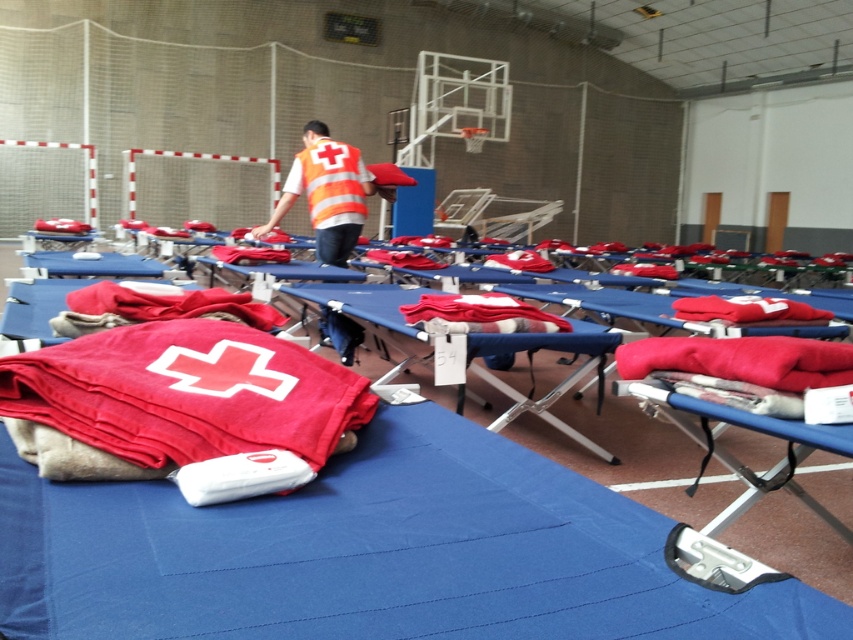
Can you confirm if orange reflective safety vest at center is wider than red cotton cloth at center?

Correct, the width of orange reflective safety vest at center exceeds that of red cotton cloth at center.

Who is taller, orange reflective safety vest at center or red cotton cloth at center?

orange reflective safety vest at center is taller.

At what (x,y) coordinates should I click in order to perform the action: click on orange reflective safety vest at center. Please return your answer as a coordinate pair (x, y). The width and height of the screenshot is (853, 640). Looking at the image, I should click on (329, 182).

Image resolution: width=853 pixels, height=640 pixels. Find the location of `orange reflective safety vest at center`. orange reflective safety vest at center is located at coordinates (329, 182).

Who is taller, red cotton blanket at lower left or orange reflective safety vest at center?

Standing taller between the two is orange reflective safety vest at center.

Image resolution: width=853 pixels, height=640 pixels. What do you see at coordinates (160, 307) in the screenshot? I see `red cotton blanket at lower left` at bounding box center [160, 307].

Is point (97, 307) less distant than point (341, 195)?

Yes, it is.

In order to click on red cotton blanket at lower left in this screenshot , I will do [160, 307].

Between red cotton cloth at center and red fabric at center, which one is positioned higher?

red fabric at center is higher up.

Is point (517, 304) farther from viewer compared to point (782, 320)?

No, (517, 304) is closer to viewer.

Is point (498, 294) closer to camera compared to point (695, 301)?

Yes, it is.

At what (x,y) coordinates should I click in order to perform the action: click on red cotton cloth at center. Please return your answer as a coordinate pair (x, y). Looking at the image, I should click on (480, 314).